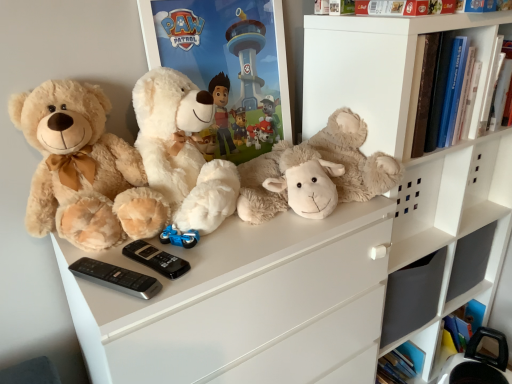
Question: From a real-world perspective, is black plastic remote at center, arranged as the first control when viewed from the back, above or below white matte shelf at upper right?

Choices:
 (A) above
 (B) below

Answer: (B)

Question: From the image's perspective, relative to white matte shelf at upper right, is black plastic remote at center, arranged as the first control when viewed from the back, above or below?

Choices:
 (A) above
 (B) below

Answer: (B)

Question: Which object is positioned closest to the soft beige teddy bear at left, arranged as the third teddy bear when viewed from the right?

Choices:
 (A) hardcover book at upper right
 (B) fluffy beige teddy bear at center, which is counted as the 1th teddy bear, starting from the right
 (C) black plastic remote at lower left, which appears as the 1th control when viewed from the front
 (D) fluffy white teddy bear at center, the second teddy bear in the right-to-left sequence
 (E) black plastic remote at center, the 2th control positioned from the front

Answer: (D)

Question: Based on their relative distances, which object is nearer to the fluffy beige teddy bear at center, which is counted as the 1th teddy bear, starting from the right?

Choices:
 (A) fluffy white teddy bear at center, acting as the 2th teddy bear starting from the left
 (B) white matte shelf at upper right
 (C) black plastic remote at lower left, which ranks as the second control in back-to-front order
 (D) hardcover book at upper right
 (E) soft beige teddy bear at left, the first teddy bear from the left

Answer: (B)